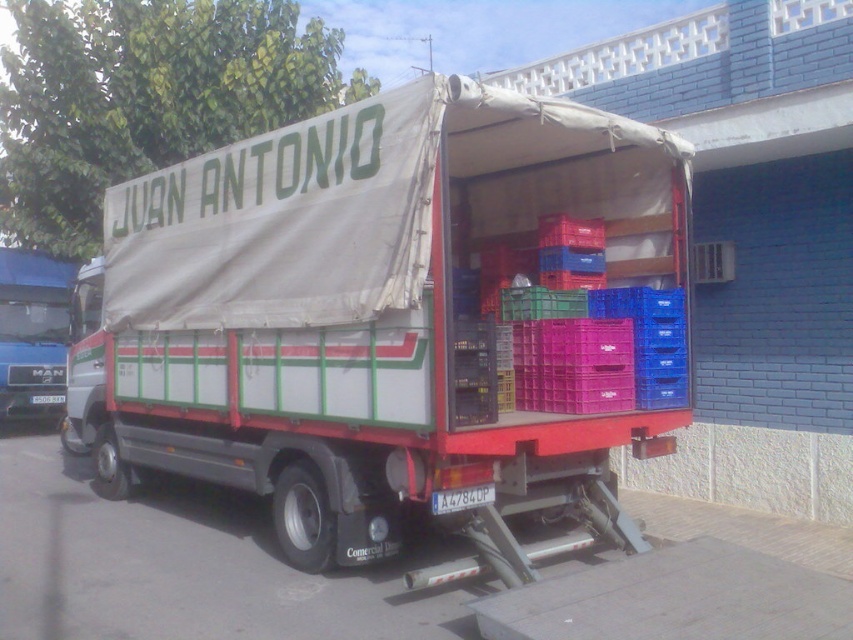
The height and width of the screenshot is (640, 853). I want to click on white canvas truck at center, so click(392, 320).

Does white canvas truck at center have a greater width compared to blue metallic truck at left?

Yes, white canvas truck at center is wider than blue metallic truck at left.

The width and height of the screenshot is (853, 640). Find the location of `white canvas truck at center`. white canvas truck at center is located at coordinates (392, 320).